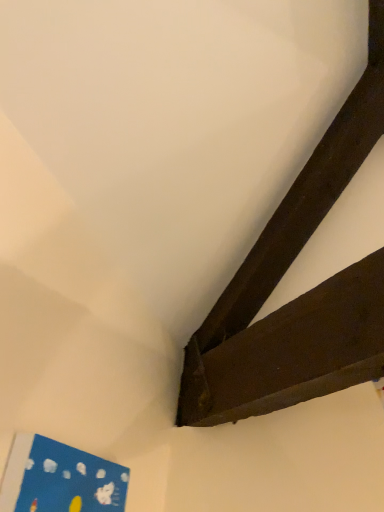
What is the approximate width of blue matte picture frame at lower left?

blue matte picture frame at lower left is 2.26 inches in width.

The image size is (384, 512). What do you see at coordinates (60, 479) in the screenshot?
I see `blue matte picture frame at lower left` at bounding box center [60, 479].

The height and width of the screenshot is (512, 384). What are the coordinates of `blue matte picture frame at lower left` in the screenshot? It's located at (60, 479).

Image resolution: width=384 pixels, height=512 pixels. Find the location of `blue matte picture frame at lower left`. blue matte picture frame at lower left is located at coordinates (60, 479).